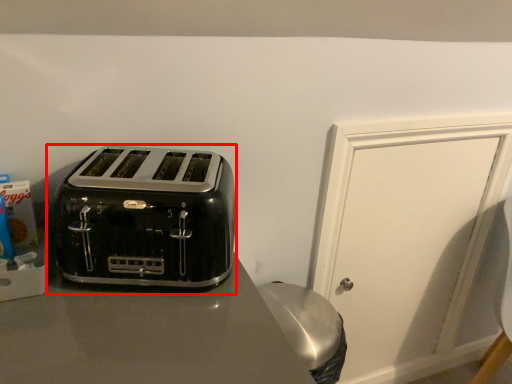
Question: Observing the image, what is the correct spatial positioning of toaster (annotated by the red box) in reference to door?

Choices:
 (A) right
 (B) left

Answer: (B)